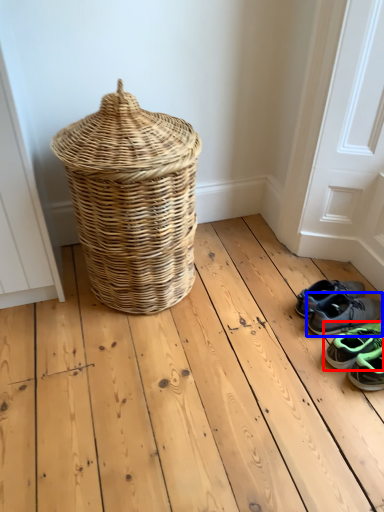
Question: Which of the following is the farthest to the observer, footwear (highlighted by a red box) or footwear (highlighted by a blue box)?

Choices:
 (A) footwear
 (B) footwear

Answer: (B)